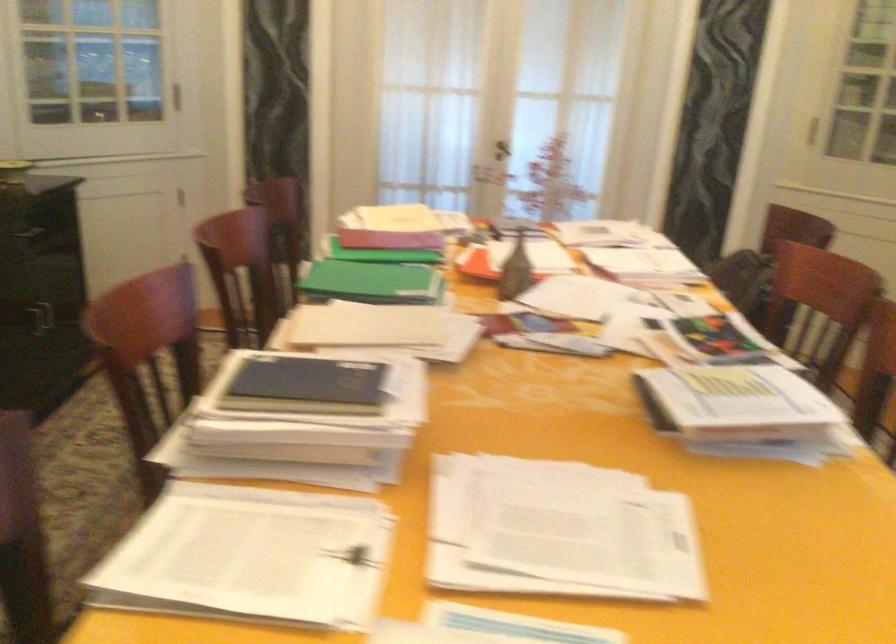
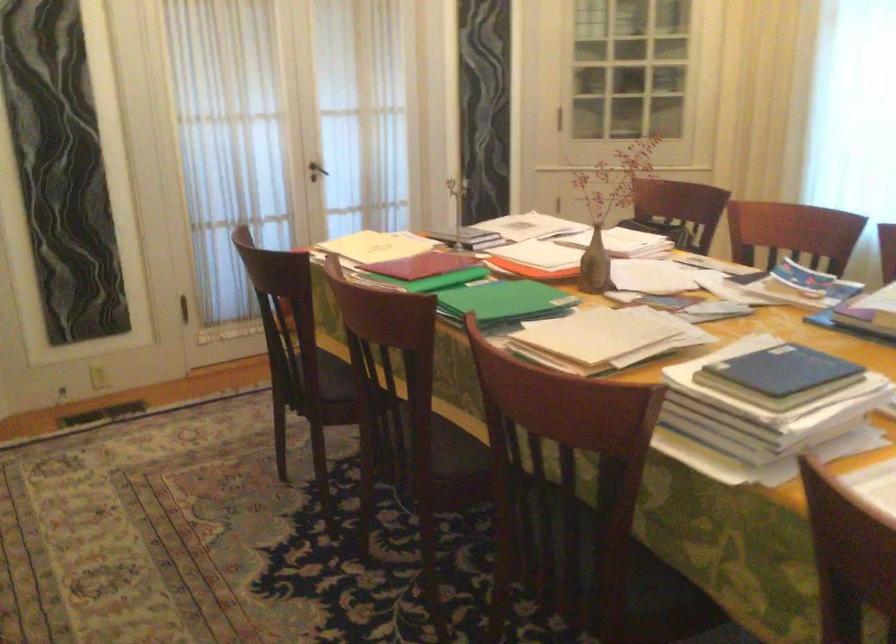
In the second image, find the point that corresponds to [500,149] in the first image.

(316, 171)